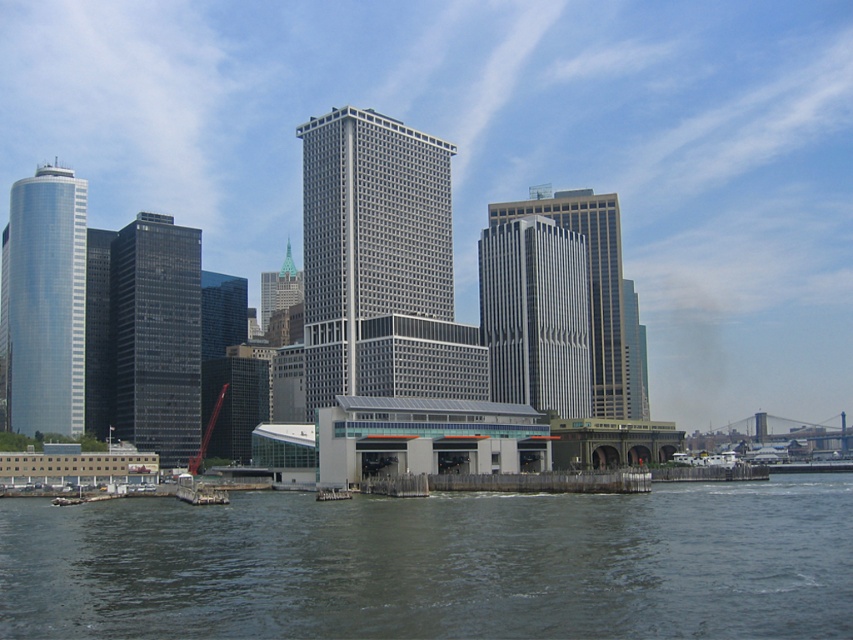
Question: Is gray concrete river at lower center to the right of gray metallic skyscraper at center from the viewer's perspective?

Choices:
 (A) yes
 (B) no

Answer: (A)

Question: Which of the following is the closest to the observer?

Choices:
 (A) silver glass skyscraper at center
 (B) glassy reflective skyscraper at left
 (C) shiny glass skyscraper at left

Answer: (B)

Question: Among these points, which one is farthest from the camera?

Choices:
 (A) (381, 296)
 (B) (274, 284)

Answer: (B)

Question: Which point is closer to the camera?

Choices:
 (A) (495, 292)
 (B) (329, 193)
 (C) (283, 269)

Answer: (B)

Question: In this image, where is gray metallic skyscraper at center located relative to shiny glass skyscraper at left?

Choices:
 (A) below
 (B) above

Answer: (B)

Question: Where is glassy reflective skyscraper at left located in relation to green glass skyscraper at center in the image?

Choices:
 (A) below
 (B) above

Answer: (A)